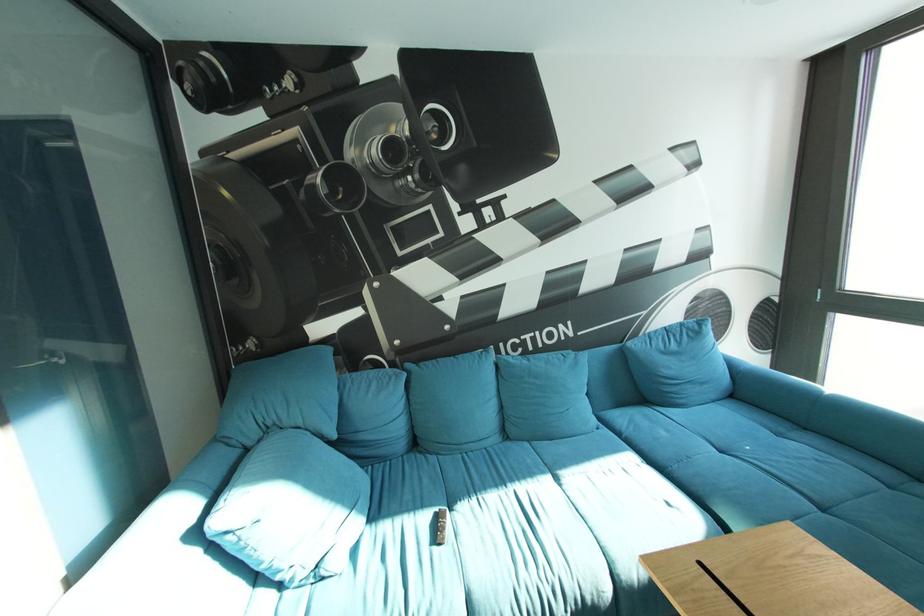
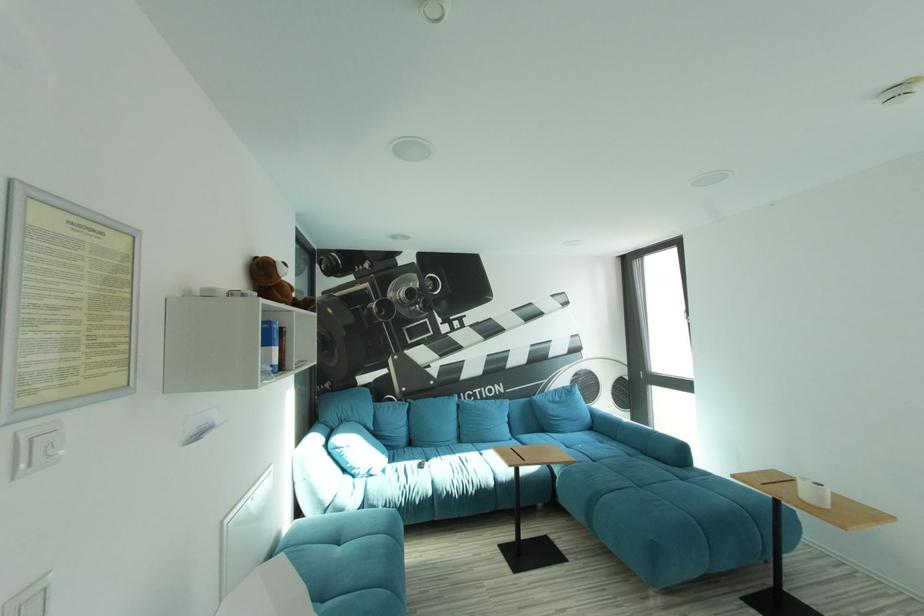
Question: In a continuous first-person perspective shot, in which direction is the camera moving?

Choices:
 (A) Left
 (B) Right
 (C) Forward
 (D) Backward

Answer: (D)